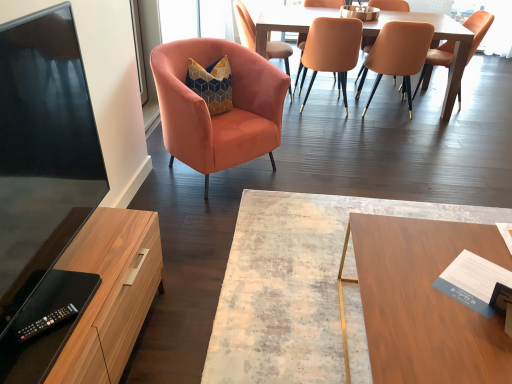
This screenshot has width=512, height=384. Find the location of `free space in front of matte orange chair at center, placed as the 3th chair when sorted from right to left`. free space in front of matte orange chair at center, placed as the 3th chair when sorted from right to left is located at coordinates (328, 125).